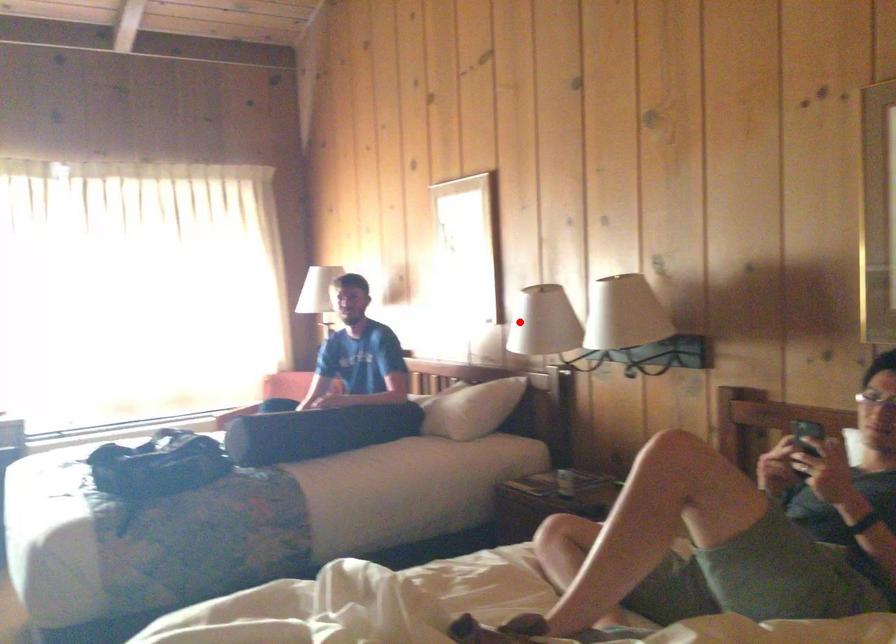
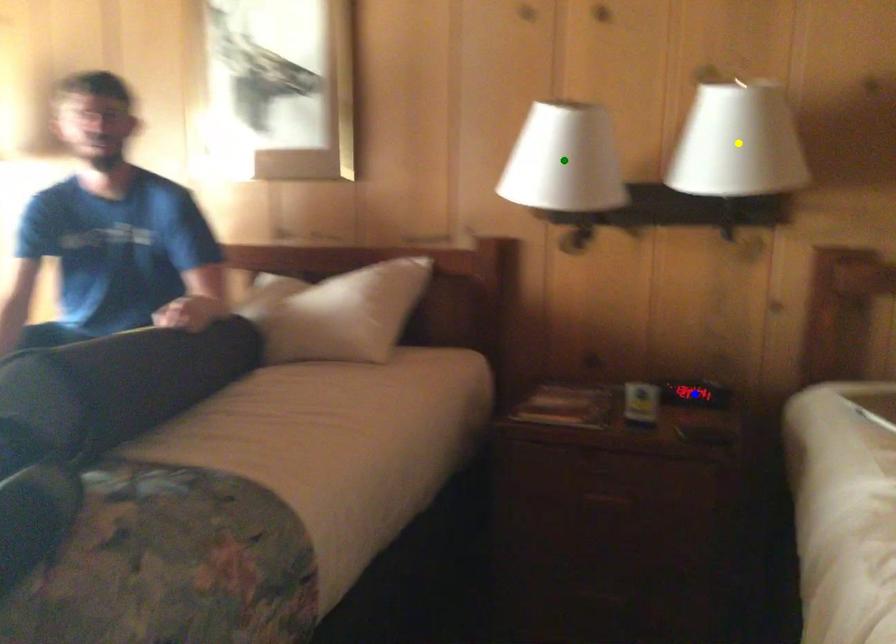
Question: I am providing you with two images of the same scene from different viewpoints. A red point is marked on the first image. You are given multiple points on the second image. Which spot in image 2 lines up with the point in image 1?

Choices:
 (A) yellow point
 (B) green point
 (C) blue point

Answer: (B)